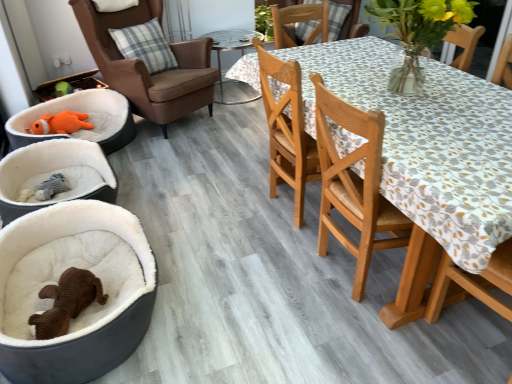
Question: Considering the relative sizes of transparent glass table at center and white plush pet bed at left in the image provided, is transparent glass table at center thinner than white plush pet bed at left?

Choices:
 (A) no
 (B) yes

Answer: (B)

Question: Is transparent glass table at center at the left side of white plush pet bed at left?

Choices:
 (A) yes
 (B) no

Answer: (B)

Question: Would you say transparent glass table at center is a long distance from white plush pet bed at left?

Choices:
 (A) yes
 (B) no

Answer: (A)

Question: Can you confirm if transparent glass table at center is smaller than white plush pet bed at left?

Choices:
 (A) yes
 (B) no

Answer: (B)

Question: Could you tell me if transparent glass table at center is turned towards white plush pet bed at left?

Choices:
 (A) yes
 (B) no

Answer: (B)

Question: Considering the positions of wooden chair at center, arranged as the 1th chair when viewed from the front, and white plush pet bed at left in the image, is wooden chair at center, arranged as the 1th chair when viewed from the front, wider or thinner than white plush pet bed at left?

Choices:
 (A) thin
 (B) wide

Answer: (A)

Question: In terms of height, does wooden chair at center, arranged as the 1th chair when viewed from the front, look taller or shorter compared to white plush pet bed at left?

Choices:
 (A) short
 (B) tall

Answer: (B)

Question: From a real-world perspective, is wooden chair at center, the 2th chair viewed from the left, physically located above or below white plush pet bed at left?

Choices:
 (A) below
 (B) above

Answer: (B)

Question: Is point (273, 69) positioned closer to the camera than point (74, 147)?

Choices:
 (A) closer
 (B) farther

Answer: (A)

Question: From the image's perspective, is wooden table at right above or below brown leather armchair at upper left, which is the first chair from left to right?

Choices:
 (A) above
 (B) below

Answer: (B)

Question: Considering the positions of point (415, 132) and point (111, 14), is point (415, 132) closer or farther from the camera than point (111, 14)?

Choices:
 (A) closer
 (B) farther

Answer: (A)

Question: Is wooden table at right wider or thinner than brown leather armchair at upper left, marked as the 2th chair in a front-to-back arrangement?

Choices:
 (A) wide
 (B) thin

Answer: (B)

Question: In terms of size, does wooden table at right appear bigger or smaller than brown leather armchair at upper left, which is the first chair from left to right?

Choices:
 (A) small
 (B) big

Answer: (A)

Question: From a real-world perspective, is plaid fabric pillow at upper left above or below wooden chair at center, arranged as the 1th chair when viewed from the front?

Choices:
 (A) above
 (B) below

Answer: (A)

Question: Relative to wooden chair at center, arranged as the 1th chair when viewed from the front, is plaid fabric pillow at upper left in front or behind?

Choices:
 (A) front
 (B) behind

Answer: (B)